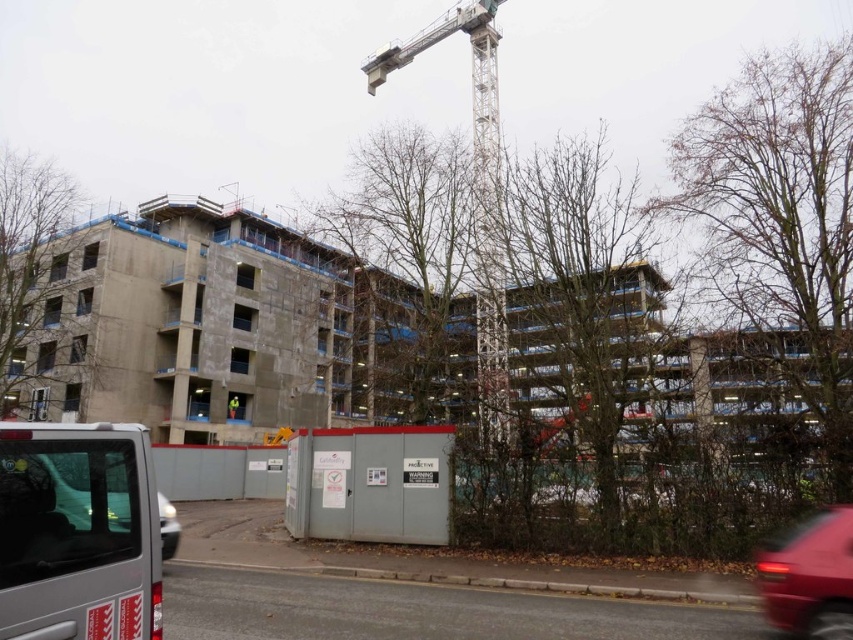
Question: Which point is closer to the camera taking this photo?

Choices:
 (A) (230, 396)
 (B) (500, 232)

Answer: (B)

Question: Which object appears closest to the camera in this image?

Choices:
 (A) matte black van at lower left
 (B) matte red car at lower right

Answer: (A)

Question: Can you confirm if silver metallic van at lower left is thinner than green fabric construction worker at center?

Choices:
 (A) yes
 (B) no

Answer: (B)

Question: Which point is farther to the camera?

Choices:
 (A) gray concrete construction site at center
 (B) green fabric construction worker at center
 (C) matte red car at lower right

Answer: (B)

Question: From the image, what is the correct spatial relationship of metallic gray crane at upper center in relation to green fabric construction worker at center?

Choices:
 (A) right
 (B) left

Answer: (A)

Question: In this image, where is silver metallic van at lower left located relative to matte black van at lower left?

Choices:
 (A) left
 (B) right

Answer: (A)